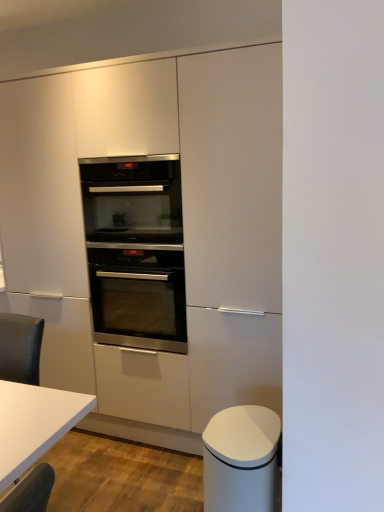
Image resolution: width=384 pixels, height=512 pixels. In order to click on vacant region above white matte trash can at lower right, marked as the 2th cabinetry in a back-to-front arrangement (from a real-world perspective) in this screenshot , I will do [x=244, y=424].